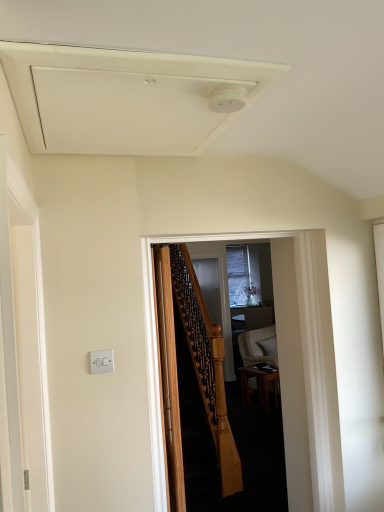
What do you see at coordinates (259, 385) in the screenshot? This screenshot has width=384, height=512. I see `wooden table at center` at bounding box center [259, 385].

Measure the distance between wooden table at center and camera.

The depth of wooden table at center is 4.73 meters.

In order to face clear glass screen door at center, marked as the first screen door in a back-to-front arrangement, should I rotate leftwards or rightwards?

A 2.463 degree turn to the right will do.

Describe the element at coordinates (291, 352) in the screenshot. I see `wooden staircase at center` at that location.

At what (x,y) coordinates should I click in order to perform the action: click on white plastic switch at left, which is the first screen door in left-to-right order. Please return your answer as a coordinate pair (x, y). Looking at the image, I should click on (31, 355).

Find the location of a particular element. The image size is (384, 512). white plastic switch at lower left is located at coordinates (101, 361).

Where is `wooden table at center`? This screenshot has height=512, width=384. wooden table at center is located at coordinates (259, 385).

Does white matte exhaust hood at upper center touch wooden door at center?

No, white matte exhaust hood at upper center is not in contact with wooden door at center.

Considering the positions of objects white matte exhaust hood at upper center and wooden door at center in the image provided, who is behind, white matte exhaust hood at upper center or wooden door at center?

wooden door at center is more distant.

In the scene shown: Between white matte exhaust hood at upper center and wooden door at center, which one has smaller size?

With smaller size is white matte exhaust hood at upper center.

Between wooden staircase at center and white plastic switch at left, which is the second screen door from back to front, which one appears on the right side from the viewer's perspective?

wooden staircase at center.

Which is in front, point (154, 339) or point (37, 387)?

The point (37, 387) is closer to the camera.

What's the angular difference between wooden staircase at center and white plastic switch at left, which is the first screen door in left-to-right order,'s facing directions?

91.3 degrees separate the facing orientations of wooden staircase at center and white plastic switch at left, which is the first screen door in left-to-right order.

Between wooden staircase at center and white plastic switch at left, which appears as the 2th screen door when viewed from the right, which one is positioned in front?

white plastic switch at left, which appears as the 2th screen door when viewed from the right, is in front.

From the image's perspective, is wooden door at center positioned above or below white plastic switch at left, which is counted as the 1th screen door, starting from the front?

From the image's perspective, wooden door at center appears below white plastic switch at left, which is counted as the 1th screen door, starting from the front.

What's the angular difference between wooden door at center and white plastic switch at left, which is the first screen door in left-to-right order,'s facing directions?

The angle between the facing direction of wooden door at center and the facing direction of white plastic switch at left, which is the first screen door in left-to-right order, is 2.54 degrees.

Is wooden door at center at the right side of white plastic switch at left, which is counted as the 1th screen door, starting from the front?

Correct, you'll find wooden door at center to the right of white plastic switch at left, which is counted as the 1th screen door, starting from the front.

Do you think wooden door at center is within white plastic switch at left, which is the second screen door from back to front, or outside of it?

wooden door at center is spatially situated outside white plastic switch at left, which is the second screen door from back to front.

Is white matte exhaust hood at upper center located within clear glass screen door at center, marked as the first screen door in a back-to-front arrangement?

Actually, white matte exhaust hood at upper center is outside clear glass screen door at center, marked as the first screen door in a back-to-front arrangement.

How much distance is there between clear glass screen door at center, marked as the first screen door in a back-to-front arrangement, and white matte exhaust hood at upper center?

clear glass screen door at center, marked as the first screen door in a back-to-front arrangement, and white matte exhaust hood at upper center are 8.03 feet apart from each other.

Is point (225, 263) closer to camera compared to point (147, 76)?

No, (225, 263) is further to viewer.

Considering the sizes of objects white matte exhaust hood at upper center and white plastic switch at lower left in the image provided, who is thinner, white matte exhaust hood at upper center or white plastic switch at lower left?

With smaller width is white plastic switch at lower left.

Is white matte exhaust hood at upper center surrounding white plastic switch at lower left?

No, white matte exhaust hood at upper center does not contain white plastic switch at lower left.

Is white matte exhaust hood at upper center placed right next to white plastic switch at lower left?

They are not placed beside each other.

Considering the relative positions of white matte exhaust hood at upper center and white plastic switch at lower left in the image provided, is white matte exhaust hood at upper center to the left of white plastic switch at lower left from the viewer's perspective?

No, white matte exhaust hood at upper center is not to the left of white plastic switch at lower left.

Where is `door to the left of wooden table at center`? The height and width of the screenshot is (512, 384). door to the left of wooden table at center is located at coordinates (169, 378).

Considering the relative sizes of wooden door at center and wooden table at center in the image provided, is wooden door at center bigger than wooden table at center?

Yes, wooden door at center is bigger than wooden table at center.

Can you confirm if wooden door at center is positioned to the left of wooden table at center?

Indeed, wooden door at center is positioned on the left side of wooden table at center.

Is white matte exhaust hood at upper center further to the viewer compared to white plastic switch at left, which is counted as the 1th screen door, starting from the front?

Yes, it is.

From the picture: In terms of height, does white matte exhaust hood at upper center look taller or shorter compared to white plastic switch at left, which appears as the 2th screen door when viewed from the right?

Considering their sizes, white matte exhaust hood at upper center has less height than white plastic switch at left, which appears as the 2th screen door when viewed from the right.

Between white matte exhaust hood at upper center and white plastic switch at left, which is the second screen door from back to front, which one has larger size?

With larger size is white plastic switch at left, which is the second screen door from back to front.

Could you tell me if white matte exhaust hood at upper center is turned towards white plastic switch at left, which is the second screen door from back to front?

No, white matte exhaust hood at upper center is not aimed at white plastic switch at left, which is the second screen door from back to front.

You are a GUI agent. You are given a task and a screenshot of the screen. Output one action in this format:
    pyautogui.click(x=<x>, y=<y>)
    Task: Click on the door lying behind the white matte exhaust hood at upper center
    Image resolution: width=384 pixels, height=512 pixels.
    Given the screenshot: What is the action you would take?
    pyautogui.click(x=169, y=378)

Find the location of a particular element. corridor that is on the right side of white plastic switch at left, which is counted as the 1th screen door, starting from the front is located at coordinates (291, 352).

Considering their positions, is white matte exhaust hood at upper center positioned further to wooden staircase at center than wooden door at center?

white matte exhaust hood at upper center lies further to wooden staircase at center than the other object.

When comparing their distances from white plastic switch at left, which is counted as the 1th screen door, starting from the front, does clear glass screen door at center, the 2th screen door positioned from the left, or white matte exhaust hood at upper center seem further?

clear glass screen door at center, the 2th screen door positioned from the left.

Which object lies nearer to the anchor point clear glass screen door at center, marked as the 2th screen door in a front-to-back arrangement, white plastic switch at lower left or white matte exhaust hood at upper center?

white plastic switch at lower left is positioned closer to the anchor clear glass screen door at center, marked as the 2th screen door in a front-to-back arrangement.

Considering their positions, is clear glass screen door at center, marked as the first screen door in a back-to-front arrangement, positioned closer to white matte exhaust hood at upper center than white plastic switch at lower left?

white plastic switch at lower left lies closer to white matte exhaust hood at upper center than the other object.

Considering their positions, is wooden door at center positioned further to white plastic switch at lower left than wooden staircase at center?

Based on the image, wooden staircase at center appears to be further to white plastic switch at lower left.

When comparing their distances from clear glass screen door at center, the 2th screen door positioned from the left, does wooden staircase at center or white plastic switch at lower left seem further?

white plastic switch at lower left is positioned further to the anchor clear glass screen door at center, the 2th screen door positioned from the left.

Considering their positions, is white plastic switch at left, which appears as the 2th screen door when viewed from the right, positioned further to wooden table at center than white matte exhaust hood at upper center?

The object further to wooden table at center is white matte exhaust hood at upper center.

When comparing their distances from wooden staircase at center, does white matte exhaust hood at upper center or white plastic switch at lower left seem further?

Among the two, white matte exhaust hood at upper center is located further to wooden staircase at center.

I want to click on electric outlet positioned between white matte exhaust hood at upper center and wooden table at center from near to far, so click(101, 361).

Locate an element on the screen. This screenshot has height=512, width=384. corridor between white plastic switch at lower left and clear glass screen door at center, acting as the first screen door starting from the right, in the front-back direction is located at coordinates (291, 352).

In order to click on door located between white plastic switch at lower left and clear glass screen door at center, the 2th screen door positioned from the left, in the depth direction in this screenshot , I will do `click(169, 378)`.

Locate an element on the screen. door between white plastic switch at left, which appears as the 2th screen door when viewed from the right, and clear glass screen door at center, acting as the first screen door starting from the right, in the front-back direction is located at coordinates (169, 378).